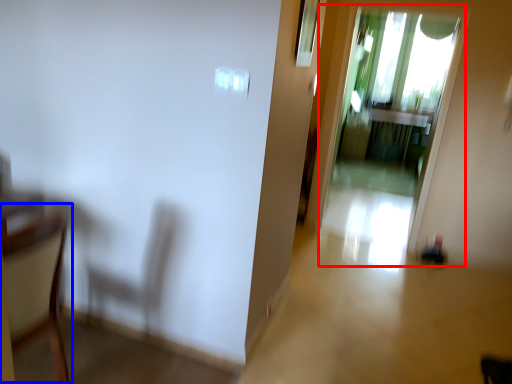
Question: Which object is further to the camera taking this photo, screen door (highlighted by a red box) or armchair (highlighted by a blue box)?

Choices:
 (A) screen door
 (B) armchair

Answer: (A)